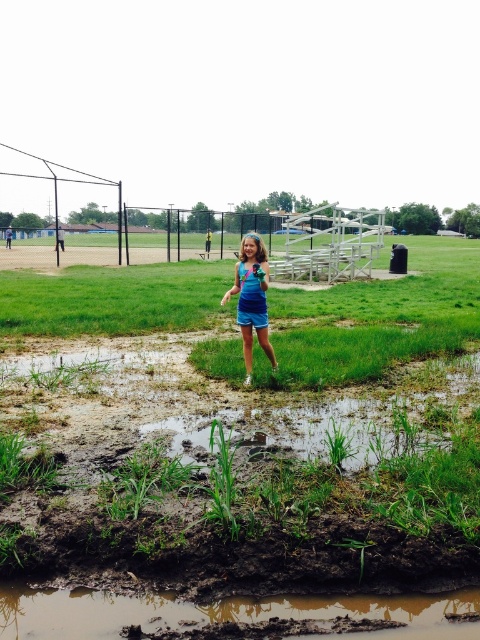
Question: Can you confirm if green grass at center is smaller than matte blue dress at center?

Choices:
 (A) yes
 (B) no

Answer: (B)

Question: Which point appears farthest from the camera in this image?

Choices:
 (A) (408, 388)
 (B) (263, 305)

Answer: (A)

Question: Is green grass at center above matte blue dress at center?

Choices:
 (A) no
 (B) yes

Answer: (B)

Question: Does muddy water at lower center appear under matte blue dress at center?

Choices:
 (A) yes
 (B) no

Answer: (A)

Question: Which point is closer to the camera?

Choices:
 (A) green grass at center
 (B) muddy water at lower center

Answer: (B)

Question: Which point is farther from the camera taking this photo?

Choices:
 (A) (252, 316)
 (B) (384, 598)
 (C) (139, 576)

Answer: (A)